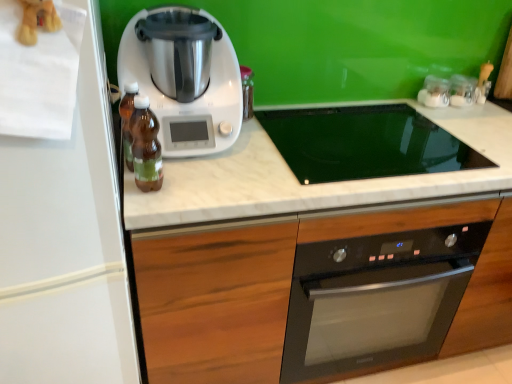
Question: Could white plastic kitchen appliance at center be considered to be inside white marble countertop at center?

Choices:
 (A) no
 (B) yes

Answer: (A)

Question: Are white marble countertop at center and white plastic kitchen appliance at center making contact?

Choices:
 (A) no
 (B) yes

Answer: (A)

Question: Considering the relative sizes of white marble countertop at center and white plastic kitchen appliance at center in the image provided, is white marble countertop at center smaller than white plastic kitchen appliance at center?

Choices:
 (A) no
 (B) yes

Answer: (A)

Question: From the image's perspective, does white marble countertop at center appear lower than white plastic kitchen appliance at center?

Choices:
 (A) no
 (B) yes

Answer: (B)

Question: Does white marble countertop at center lie in front of white plastic kitchen appliance at center?

Choices:
 (A) no
 (B) yes

Answer: (A)

Question: From a real-world perspective, is white matte refrigerator at left positioned above or below wooden cabinet at center?

Choices:
 (A) below
 (B) above

Answer: (B)

Question: Is point [x=53, y=213] positioned closer to the camera than point [x=220, y=327]?

Choices:
 (A) closer
 (B) farther

Answer: (A)

Question: Choose the correct answer: Is white matte refrigerator at left inside wooden cabinet at center or outside it?

Choices:
 (A) outside
 (B) inside

Answer: (A)

Question: In terms of width, does white matte refrigerator at left look wider or thinner when compared to wooden cabinet at center?

Choices:
 (A) wide
 (B) thin

Answer: (A)

Question: Is point (455, 104) closer or farther from the camera than point (184, 13)?

Choices:
 (A) closer
 (B) farther

Answer: (B)

Question: In terms of width, does clear glass jars at upper right, which ranks as the second appliance in left-to-right order, look wider or thinner when compared to white plastic kitchen appliance at center?

Choices:
 (A) thin
 (B) wide

Answer: (A)

Question: From the image's perspective, is clear glass jars at upper right, marked as the first appliance in a right-to-left arrangement, above or below white plastic kitchen appliance at center?

Choices:
 (A) above
 (B) below

Answer: (A)

Question: Based on their sizes in the image, would you say clear glass jars at upper right, which ranks as the second appliance in left-to-right order, is bigger or smaller than white plastic kitchen appliance at center?

Choices:
 (A) small
 (B) big

Answer: (A)

Question: Looking at their shapes, would you say white marble countertop at center is wider or thinner than wooden cabinet at center?

Choices:
 (A) thin
 (B) wide

Answer: (A)

Question: From the image's perspective, relative to wooden cabinet at center, is white marble countertop at center above or below?

Choices:
 (A) above
 (B) below

Answer: (A)